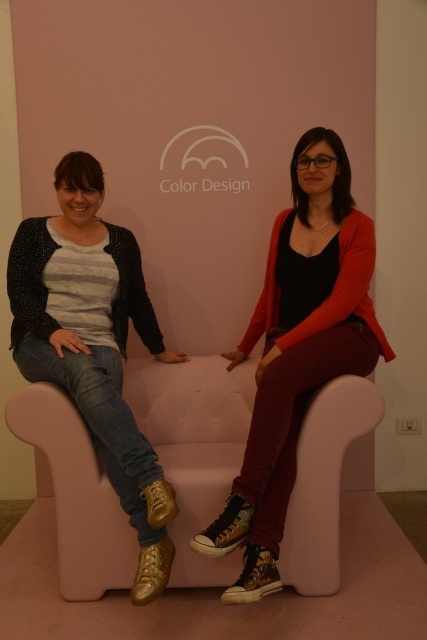
You are a delivery robot with a package that needs to be placed between the pink foam couch at center and the matte black cardigan at center. The package measures 12 inches in length. Can you fit the package between them without moving either object?

The pink foam couch at center and matte black cardigan at center are 14.15 inches apart from each other. Since the package is 12 inches long, it can fit between them as there is enough space.

You are a furniture designer evaluating the proportions of the pink foam couch at center and the denim jeans at left in the image. Which object has a greater height?

The denim jeans at left are taller than the pink foam couch at center.